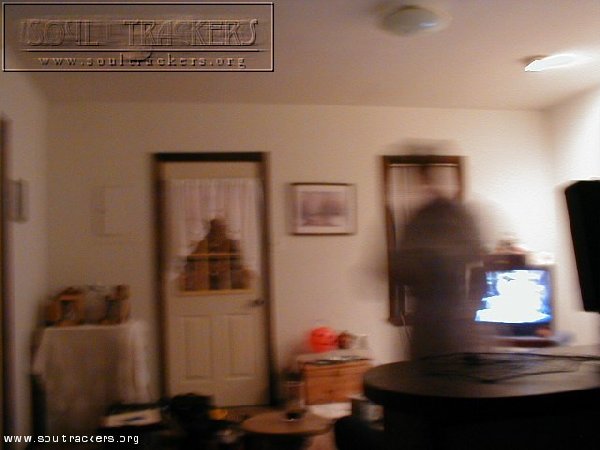
This screenshot has width=600, height=450. Identify the location of tv. (525, 305).